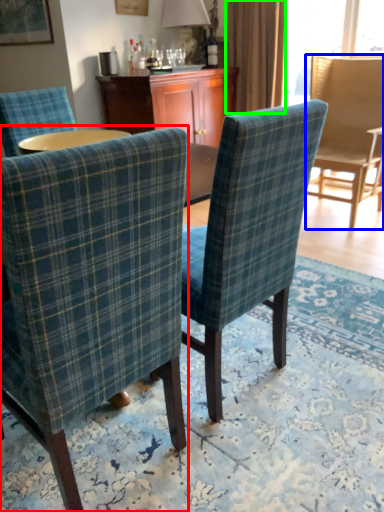
Question: Which object is positioned farthest from chair (highlighted by a red box)? Select from chair (highlighted by a blue box) and curtain (highlighted by a green box).

Choices:
 (A) chair
 (B) curtain

Answer: (B)